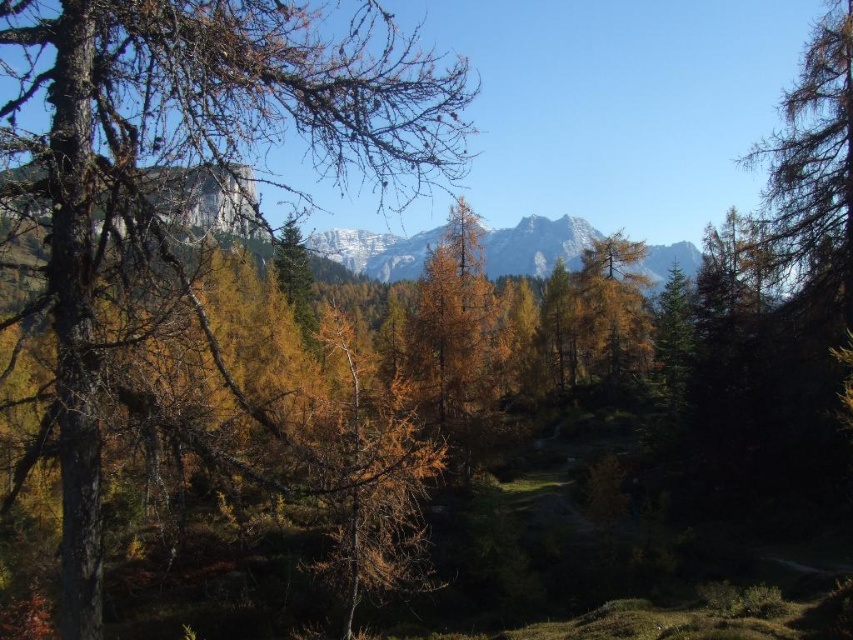
You are standing in the autumn mountain landscape and see a point marked at coordinates (187, 161). Which object from the scene does this point belong to?

The point at coordinates (187, 161) is located on the brown rough bark tree at left.